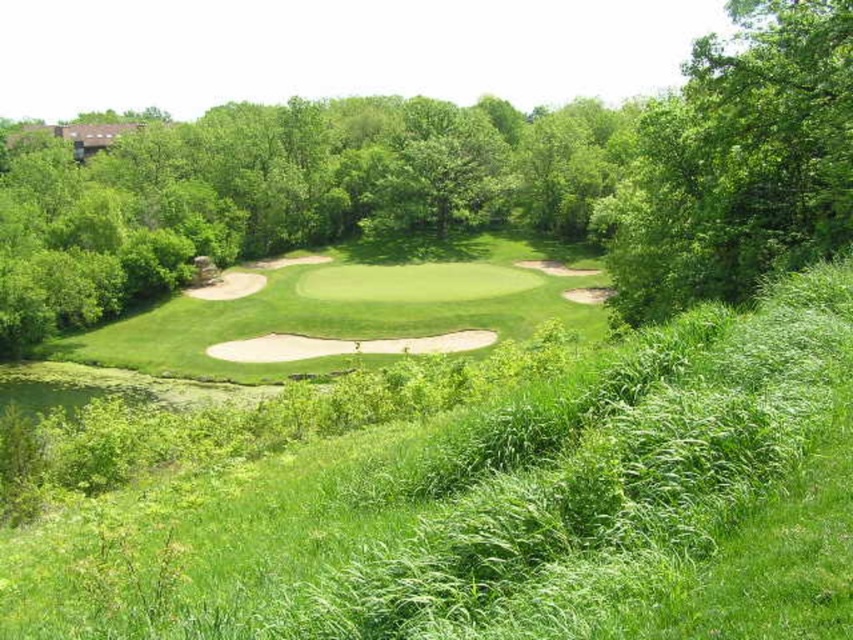
You are a golfer standing on the green grassy golf course at center and want to hit a ball towards the green leafy tree at upper right. Considering their positions, will the tree block your shot if you aim directly at it?

The green grassy golf course at center is in front of the green leafy tree at upper right, so the tree is behind the golf course. Therefore, the tree will not block your shot as it is positioned behind the course area where you are standing.

You are a golfer standing on the green grassy golf course at center and want to hit a ball towards the green leafy tree at center. Considering their widths, which object will the ball pass closer to after being hit?

The ball will pass closer to the green grassy golf course at center because it has a lesser width compared to the green leafy tree at center.